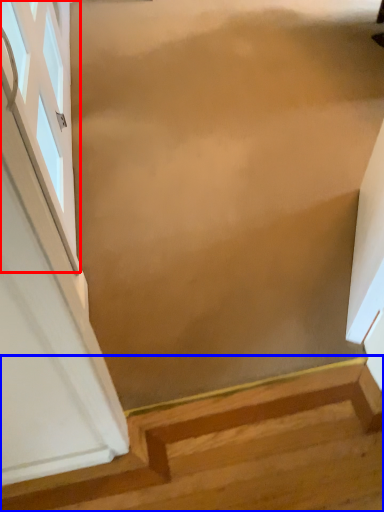
Question: Which of the following is the closest to the observer, window (highlighted by a red box) or stairs (highlighted by a blue box)?

Choices:
 (A) window
 (B) stairs

Answer: (B)